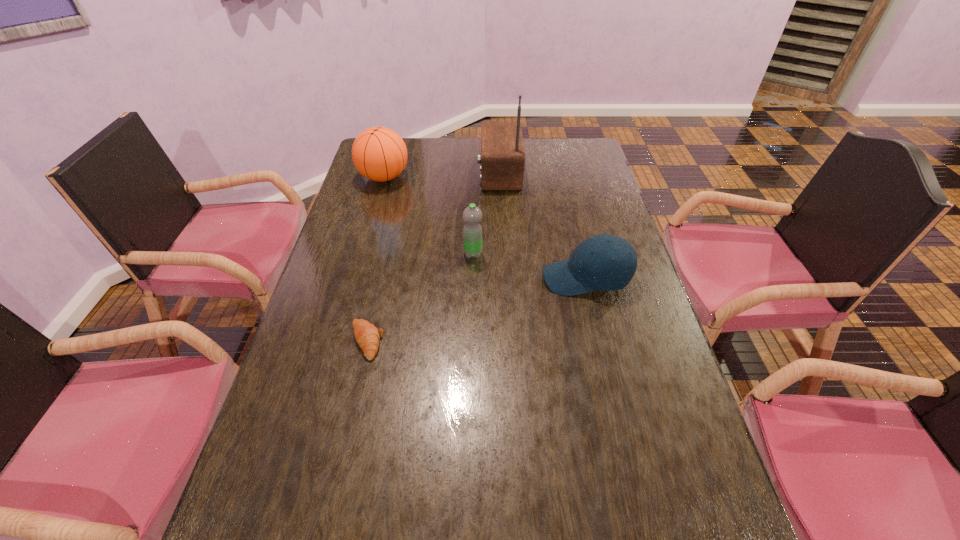
Identify the location of radio receiver. (502, 158).

The image size is (960, 540). What are the coordinates of `basketball` in the screenshot? It's located at (379, 154).

Identify the location of the third nearest object. Image resolution: width=960 pixels, height=540 pixels. (472, 232).

The width and height of the screenshot is (960, 540). Identify the location of the second nearest object. (604, 262).

This screenshot has width=960, height=540. Identify the location of the rightmost object. (604, 262).

Find the location of a particular element. The image size is (960, 540). the nearest object is located at coordinates (367, 335).

The height and width of the screenshot is (540, 960). In order to click on crescent roll in this screenshot , I will do `click(367, 335)`.

The width and height of the screenshot is (960, 540). Identify the location of free space located on the front-facing side of the tallest object. (437, 172).

Where is `free space located 0.230m on the front-facing side of the tallest object`? This screenshot has width=960, height=540. free space located 0.230m on the front-facing side of the tallest object is located at coordinates (416, 172).

What are the coordinates of `vacant area located on the front-facing side of the tallest object` in the screenshot? It's located at (445, 172).